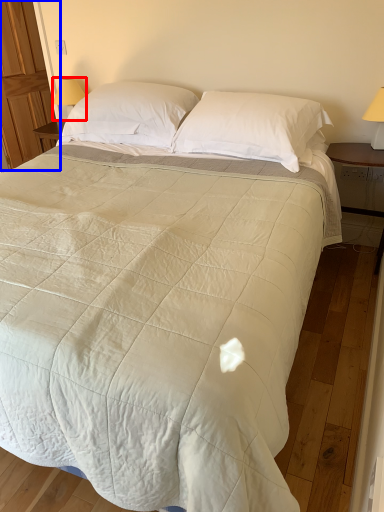
Question: Which point is closer to the camera, table lamp (highlighted by a red box) or armoire (highlighted by a blue box)?

Choices:
 (A) table lamp
 (B) armoire

Answer: (A)